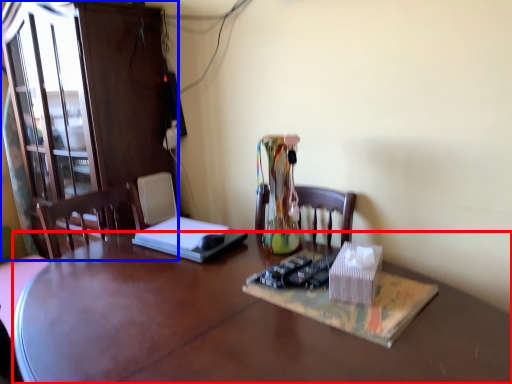
Question: Which point is further to the camera, desk (highlighted by a red box) or cabinetry (highlighted by a blue box)?

Choices:
 (A) desk
 (B) cabinetry

Answer: (B)